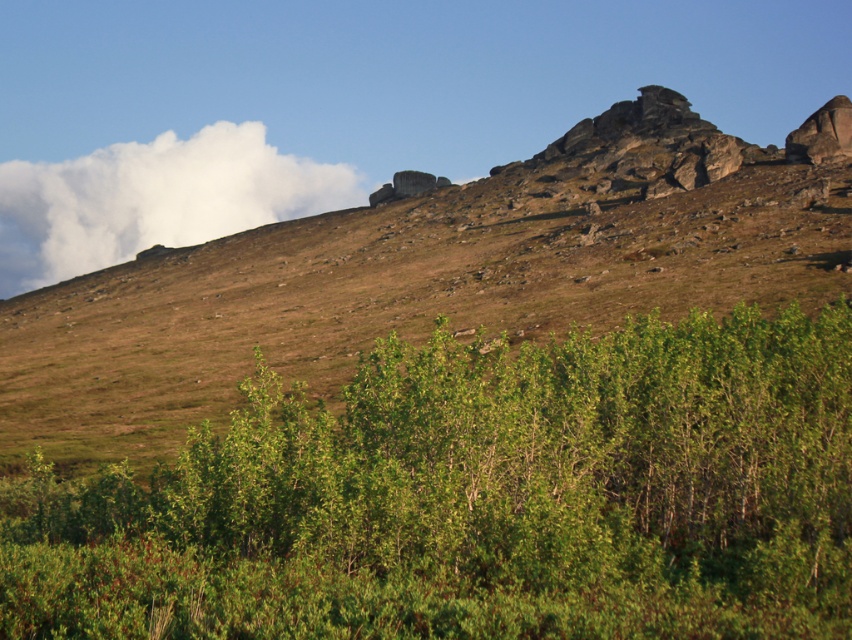
Who is higher up, rugged stone mountain at upper center or white fluffy cloud at upper left?

white fluffy cloud at upper left is higher up.

The width and height of the screenshot is (852, 640). In order to click on rugged stone mountain at upper center in this screenshot , I will do `click(430, 275)`.

Can you confirm if green leafy shrubs at lower center is wider than rugged stone mountain at upper center?

No, green leafy shrubs at lower center is not wider than rugged stone mountain at upper center.

This screenshot has width=852, height=640. What do you see at coordinates (476, 499) in the screenshot?
I see `green leafy shrubs at lower center` at bounding box center [476, 499].

You are a GUI agent. You are given a task and a screenshot of the screen. Output one action in this format:
    pyautogui.click(x=<x>, y=<y>)
    Task: Click on the green leafy shrubs at lower center
    
    Given the screenshot: What is the action you would take?
    click(x=476, y=499)

Find the location of a particular element. green leafy shrubs at lower center is located at coordinates (476, 499).

Can you confirm if green leafy shrubs at lower center is wider than white fluffy cloud at upper left?

No, green leafy shrubs at lower center is not wider than white fluffy cloud at upper left.

Does green leafy shrubs at lower center have a greater height compared to white fluffy cloud at upper left?

No.

Is point (628, 512) farther from camera compared to point (9, 161)?

No, (628, 512) is in front of (9, 161).

Image resolution: width=852 pixels, height=640 pixels. In order to click on green leafy shrubs at lower center in this screenshot , I will do `click(476, 499)`.